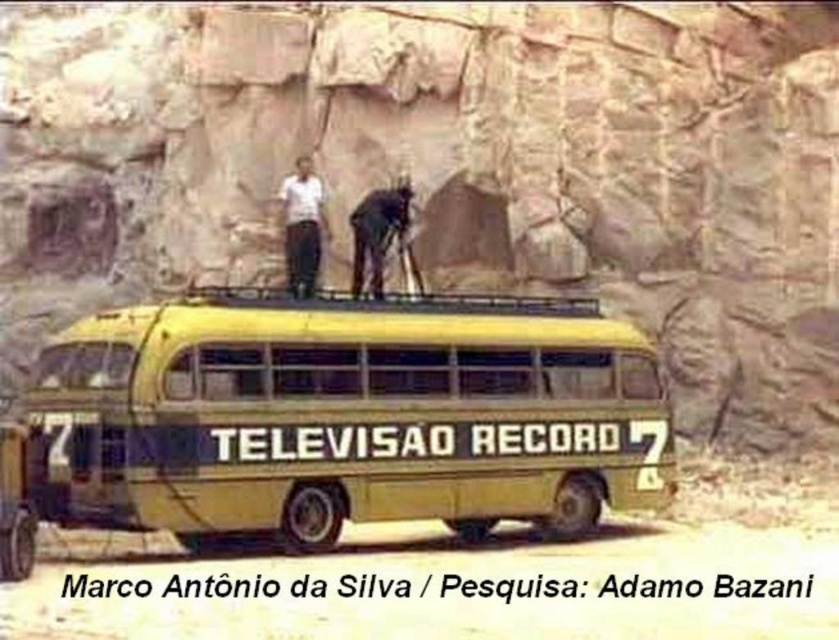
Based on the photo, you are a photographer trying to capture the yellow matte bus at center and the rough stone wall at upper center in a single shot. Based on their sizes, which object should you focus on to ensure both are clearly visible in the frame?

The rough stone wall at upper center is larger in size than the yellow matte bus at center, so focusing on the larger rough stone wall at upper center will help ensure both objects are clearly visible in the frame.

You are a photographer trying to capture a photo of the yellow matte bus at center and the white matte shirt at upper center. Based on their positions, which object is located to the left of the other?

The yellow matte bus at center is positioned on the left side of white matte shirt at upper center.

You are standing in front of the vintage yellow bus parked in front of a large rock formation. You need to locate the rough stone wall at upper center. Where would you look relative to the bus?

The rough stone wall at upper center is located at the coordinates point (452,168) relative to the bus.